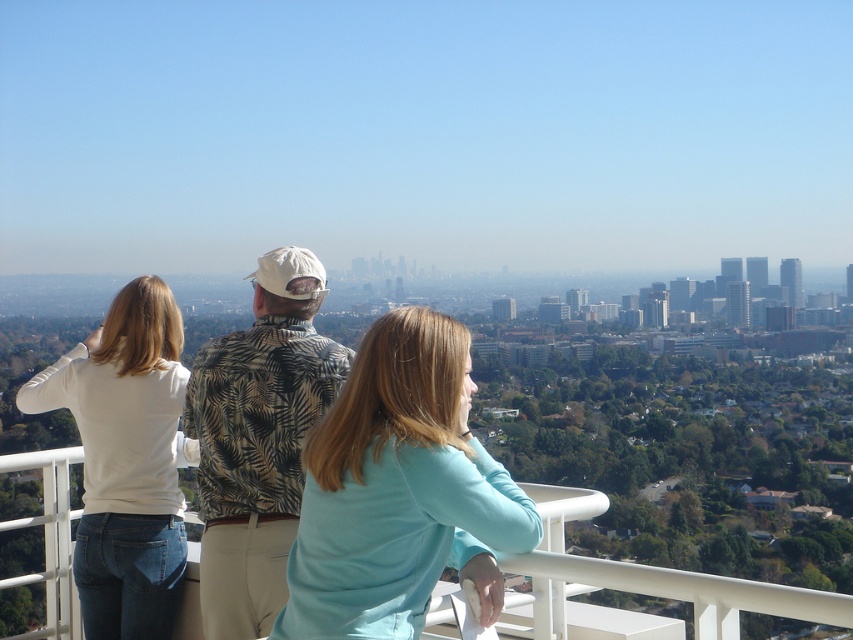
You are standing on the balcony and want to place a small plant between the two points marked as point (445, 500) and point (79, 532). Which point should the plant be closer to so it is positioned in front of the other point?

The plant should be placed closer to point (445, 500) because it is in front of point (79, 532).

You are a photographer trying to capture a group photo of the white cotton shirt at center and the white matte shirt at left. Since you want everyone to be visible, which person should stand closer to the camera to avoid being blocked?

The white matte shirt at left should stand closer to the camera because it is shorter than the white cotton shirt at center, allowing both to be visible without obstruction.

You are a photographer trying to capture the light blue fabric at center and the white cotton shirt at center in the same frame. Based on their positions, which one will appear higher in the photo?

The light blue fabric at center appears higher in the photo because it is located above the white cotton shirt at center.